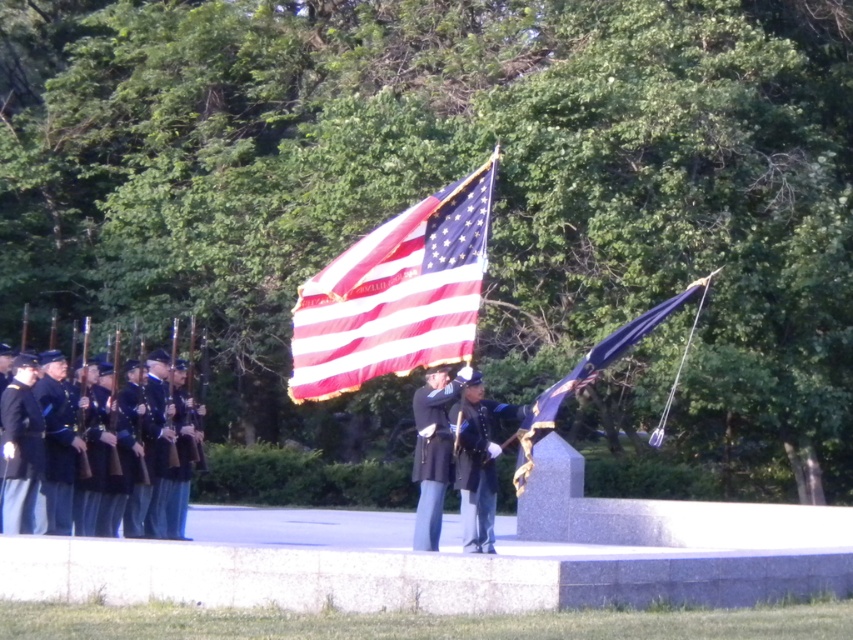
In the scene shown: Between shiny blue fabric uniform at center and blue satin flag at center, which one is positioned lower?

shiny blue fabric uniform at center

Is shiny blue fabric uniform at center below blue satin flag at center?

Yes.

Between point (456, 429) and point (657, 435), which one is positioned in front?

Positioned in front is point (456, 429).

Identify the location of shiny blue fabric uniform at center. The image size is (853, 640). (479, 464).

Does matte fabric flag at center appear on the left side of blue uniformed soldiers at left?

In fact, matte fabric flag at center is to the right of blue uniformed soldiers at left.

In the scene shown: Who is positioned more to the right, matte fabric flag at center or blue uniformed soldiers at left?

From the viewer's perspective, matte fabric flag at center appears more on the right side.

Between point (461, 262) and point (41, 388), which one is positioned behind?

Positioned behind is point (461, 262).

Where is `matte fabric flag at center`? The image size is (853, 640). matte fabric flag at center is located at coordinates (395, 294).

Is point (381, 260) positioned behind point (689, 289)?

No.

Image resolution: width=853 pixels, height=640 pixels. Find the location of `matte fabric flag at center`. matte fabric flag at center is located at coordinates (395, 294).